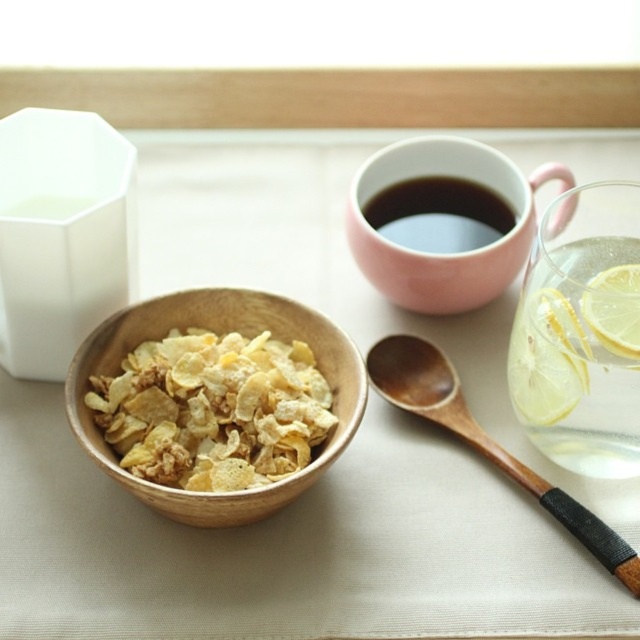
In order to click on translucent glass lemon at right in this screenshot , I will do `click(545, 358)`.

Which is in front, point (518, 316) or point (605, 336)?

Point (605, 336) is in front.

In order to click on translucent glass lemon at right in this screenshot , I will do `click(545, 358)`.

Can you confirm if wooden spoon at lower right is shorter than matte pink cup at upper center?

In fact, wooden spoon at lower right may be taller than matte pink cup at upper center.

How distant is wooden spoon at lower right from matte pink cup at upper center?

They are 5.82 inches apart.

Where is `wooden spoon at lower right`? The width and height of the screenshot is (640, 640). wooden spoon at lower right is located at coordinates (484, 440).

Is wooden spoon at lower right positioned behind translucent glass lemon at right?

Yes, wooden spoon at lower right is behind translucent glass lemon at right.

Is wooden spoon at lower right below translucent glass lemon at right?

Correct, wooden spoon at lower right is located below translucent glass lemon at right.

Does point (397, 340) lie in front of point (532, 317)?

No, (397, 340) is further to viewer.

Where is `wooden spoon at lower right`? wooden spoon at lower right is located at coordinates (484, 440).